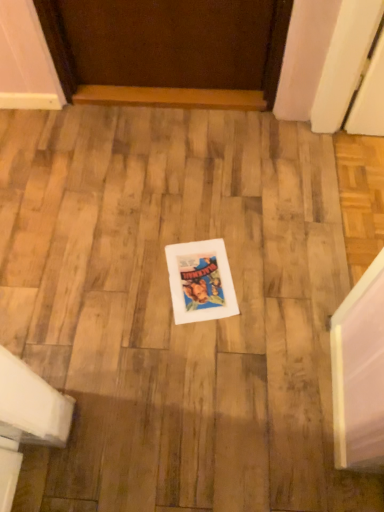
Image resolution: width=384 pixels, height=512 pixels. What are the coordinates of `free space behind matte paper comic book at center` in the screenshot? It's located at (202, 218).